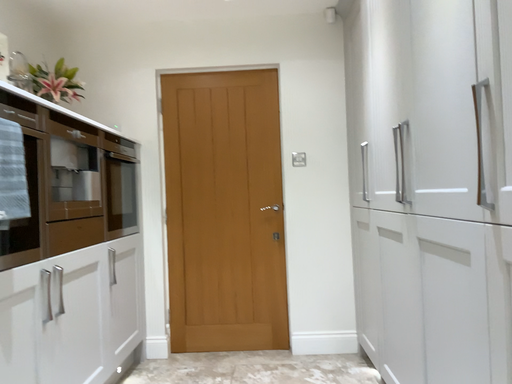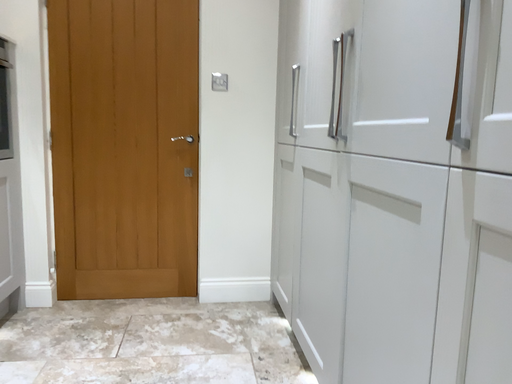
Question: Which way did the camera rotate in the video?

Choices:
 (A) rotated left
 (B) rotated right

Answer: (B)